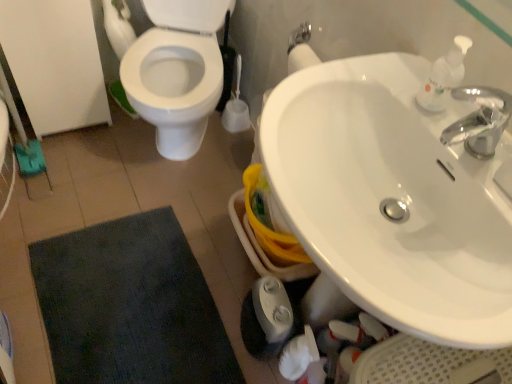
This screenshot has width=512, height=384. What are the coordinates of `blank space above dark blue textured bath mat at lower left (from a real-world perspective)` in the screenshot? It's located at (129, 307).